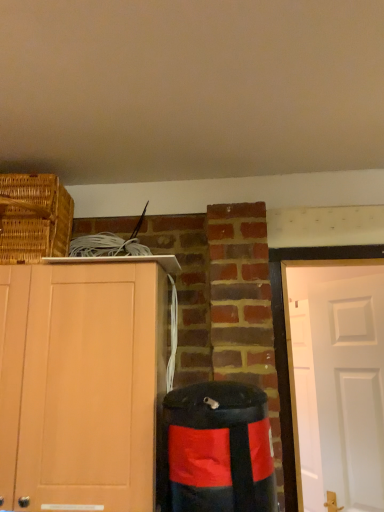
Question: Is light wood cabinet at left facing towards black matte waste container at lower right?

Choices:
 (A) no
 (B) yes

Answer: (A)

Question: Considering the relative sizes of light wood cabinet at left and black matte waste container at lower right in the image provided, is light wood cabinet at left thinner than black matte waste container at lower right?

Choices:
 (A) yes
 (B) no

Answer: (B)

Question: Considering the relative positions of light wood cabinet at left and black matte waste container at lower right in the image provided, is light wood cabinet at left to the right of black matte waste container at lower right from the viewer's perspective?

Choices:
 (A) yes
 (B) no

Answer: (B)

Question: From the image's perspective, is light wood cabinet at left located beneath black matte waste container at lower right?

Choices:
 (A) yes
 (B) no

Answer: (B)

Question: Is light wood cabinet at left positioned before black matte waste container at lower right?

Choices:
 (A) no
 (B) yes

Answer: (A)

Question: From the image's perspective, is black matte waste container at lower right located above or below woven brown basket at upper left?

Choices:
 (A) below
 (B) above

Answer: (A)

Question: From a real-world perspective, is black matte waste container at lower right physically located above or below woven brown basket at upper left?

Choices:
 (A) below
 (B) above

Answer: (A)

Question: Does point (246, 431) appear closer or farther from the camera than point (11, 254)?

Choices:
 (A) farther
 (B) closer

Answer: (B)

Question: Would you say black matte waste container at lower right is to the left or to the right of woven brown basket at upper left in the picture?

Choices:
 (A) left
 (B) right

Answer: (B)

Question: Visually, is woven brown basket at upper left positioned to the left or to the right of black matte waste container at lower right?

Choices:
 (A) left
 (B) right

Answer: (A)

Question: From their relative heights in the image, would you say woven brown basket at upper left is taller or shorter than black matte waste container at lower right?

Choices:
 (A) tall
 (B) short

Answer: (B)

Question: From a real-world perspective, is woven brown basket at upper left above or below black matte waste container at lower right?

Choices:
 (A) above
 (B) below

Answer: (A)

Question: Is woven brown basket at upper left wider or thinner than black matte waste container at lower right?

Choices:
 (A) wide
 (B) thin

Answer: (A)

Question: From a real-world perspective, is light wood cabinet at left positioned above or below woven brown basket at upper left?

Choices:
 (A) above
 (B) below

Answer: (B)

Question: From the image's perspective, relative to woven brown basket at upper left, is light wood cabinet at left above or below?

Choices:
 (A) below
 (B) above

Answer: (A)